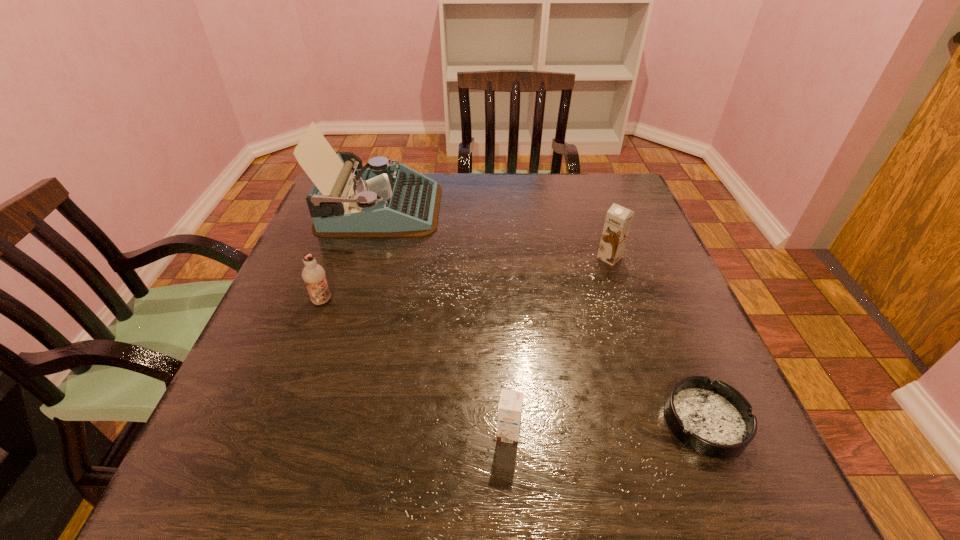
Locate an element on the screen. This screenshot has height=540, width=960. object that is at the far left corner is located at coordinates 384,200.

Find the location of a particular element. object situated at the near right corner is located at coordinates (712, 418).

In order to click on vacant space at the far edge of the desktop in this screenshot , I will do `click(468, 173)`.

Find the location of `vacant region at the left edge of the desktop`. vacant region at the left edge of the desktop is located at coordinates (351, 263).

Identify the location of vacant space at the right edge of the desktop. (659, 301).

Where is `free space at the far right corner of the desktop`? This screenshot has height=540, width=960. free space at the far right corner of the desktop is located at coordinates (636, 195).

Identify the location of free spot between the farthest chocolate milk and the ashtray. (658, 340).

Locate an element on the screen. The image size is (960, 540). free space between the second nearest chocolate milk and the shortest chocolate milk is located at coordinates (416, 367).

At what (x,y) coordinates should I click in order to perform the action: click on unoccupied position between the typewriter and the third farthest object. Please return your answer as a coordinate pair (x, y). Looking at the image, I should click on (351, 255).

Where is `free area in between the leftmost chocolate milk and the third object from right to left`? free area in between the leftmost chocolate milk and the third object from right to left is located at coordinates pos(416,367).